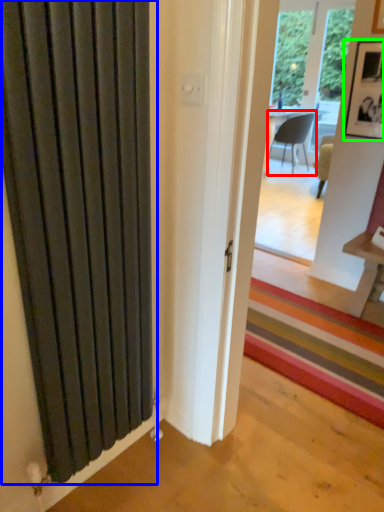
Question: Estimate the real-world distances between objects in this image. Which object is closer to chair (highlighted by a red box), door (highlighted by a blue box) or picture frame (highlighted by a green box)?

Choices:
 (A) door
 (B) picture frame

Answer: (B)